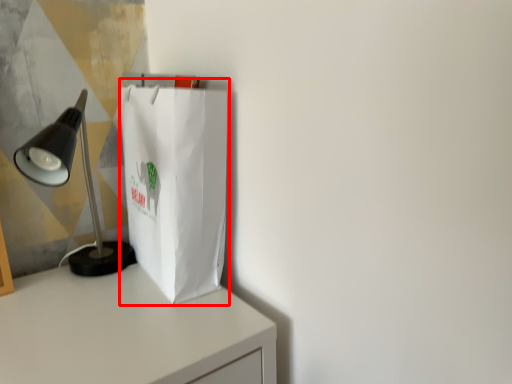
Question: Observing the image, what is the correct spatial positioning of grocery bag (annotated by the red box) in reference to lamp?

Choices:
 (A) left
 (B) right

Answer: (B)